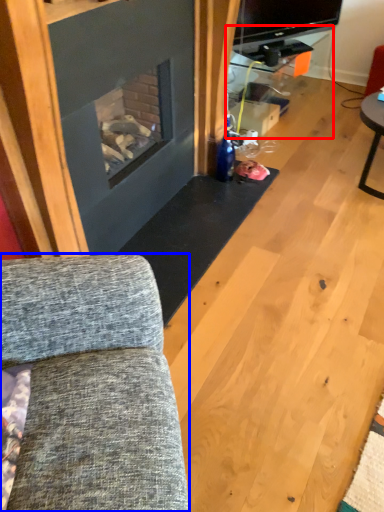
Question: Among these objects, which one is nearest to the camera, entertainment center (highlighted by a red box) or studio couch (highlighted by a blue box)?

Choices:
 (A) entertainment center
 (B) studio couch

Answer: (B)